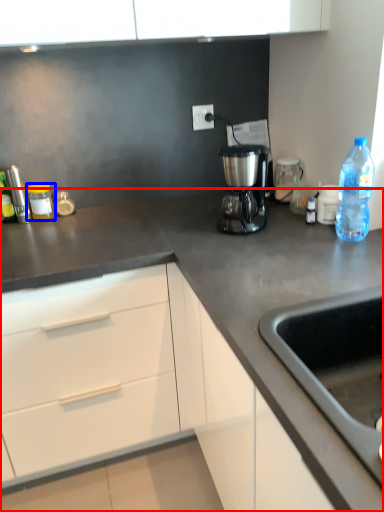
Question: Which point is further to the camera, countertop (highlighted by a red box) or kitchen appliance (highlighted by a blue box)?

Choices:
 (A) countertop
 (B) kitchen appliance

Answer: (B)